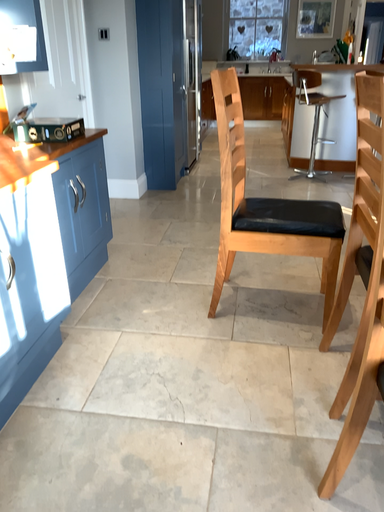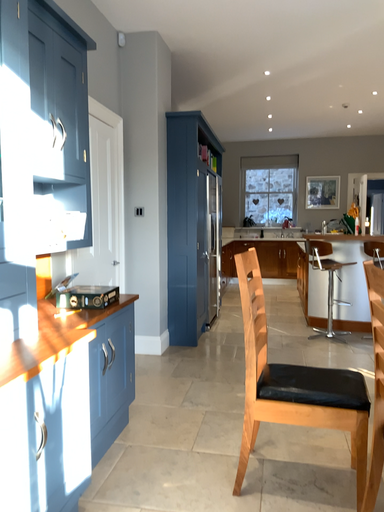
Question: Which way did the camera rotate in the video?

Choices:
 (A) rotated downward
 (B) rotated upward

Answer: (B)